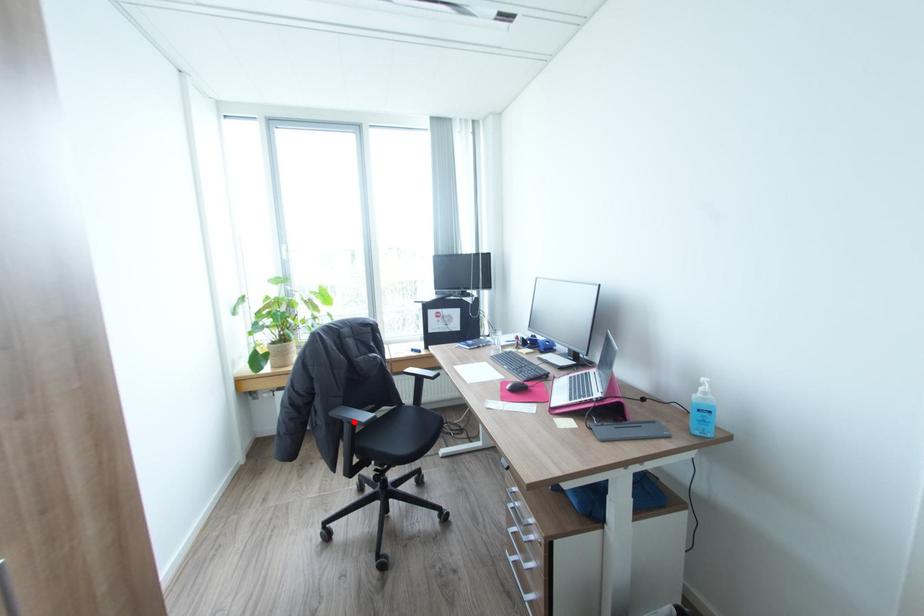
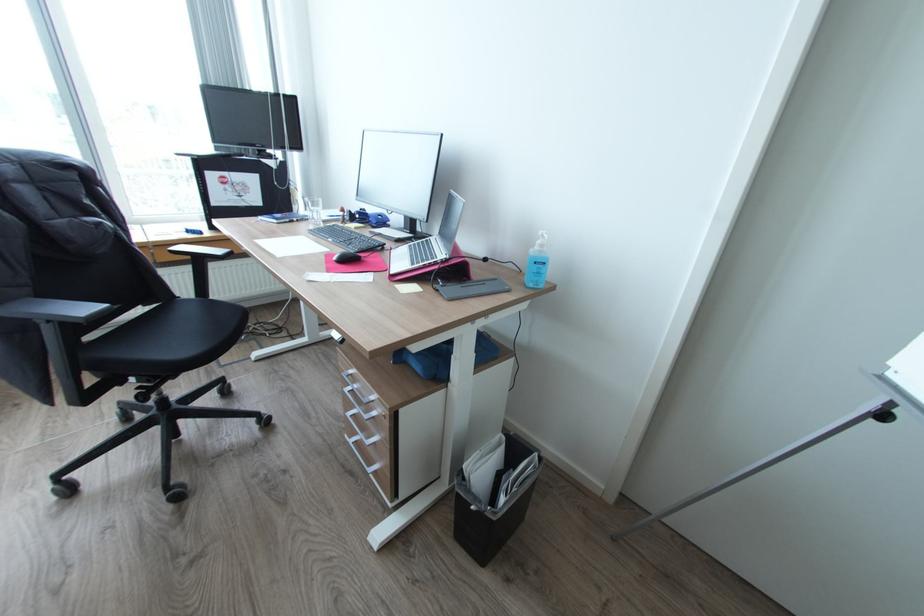
Question: I am providing you with two images of the same scene from different viewpoints. Image1 has a red point marked. In image2, the corresponding 3D location appears at what relative position? Reply with the corresponding letter.

Choices:
 (A) Closer
 (B) Farther

Answer: (B)